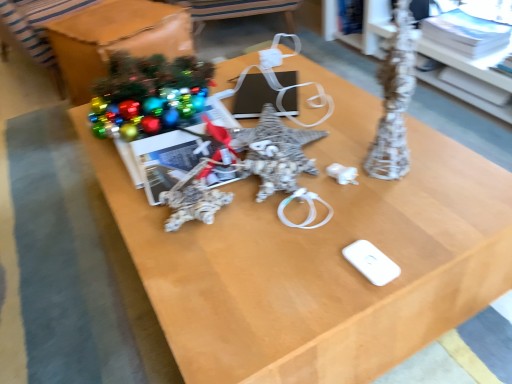
The image size is (512, 384). Find the location of `vacant space to the left of white matte ipod at lower right`. vacant space to the left of white matte ipod at lower right is located at coordinates (281, 275).